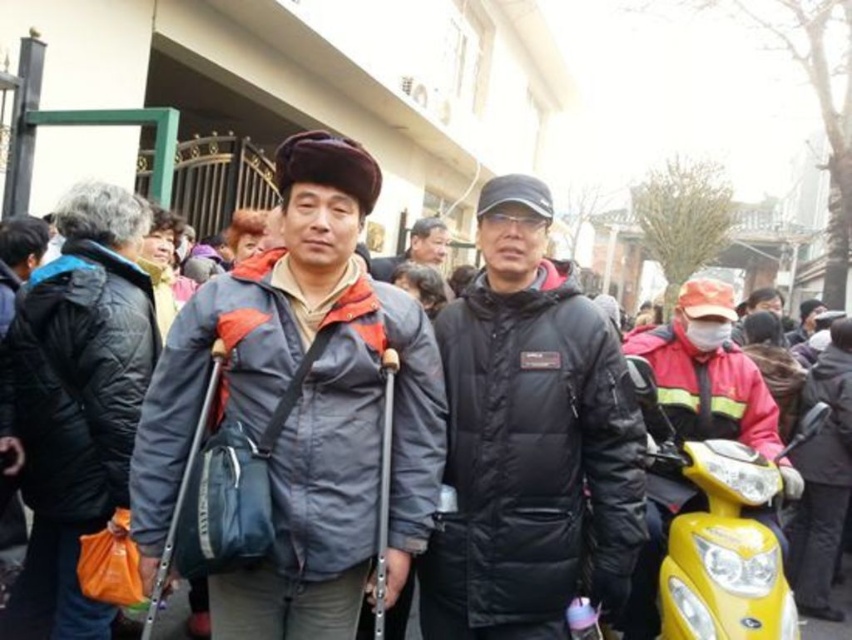
Question: Which is farther from the matte gray jacket at center?

Choices:
 (A) yellow matte motorcycle at lower right
 (B) dark gray puffer jacket at center
 (C) black matte jacket at center

Answer: (B)

Question: Does matte gray jacket at center appear on the left side of yellow matte motorcycle at lower right?

Choices:
 (A) yes
 (B) no

Answer: (A)

Question: Where is matte gray jacket at center located in relation to black matte jacket at center in the image?

Choices:
 (A) right
 (B) left

Answer: (B)

Question: Which is nearer to the matte gray jacket at center?

Choices:
 (A) dark gray puffer jacket at center
 (B) black matte jacket at center
 (C) yellow matte motorcycle at lower right

Answer: (B)

Question: Is black matte jacket at center bigger than yellow matte motorcycle at lower right?

Choices:
 (A) yes
 (B) no

Answer: (B)

Question: Which object is positioned closest to the yellow matte motorcycle at lower right?

Choices:
 (A) black matte jacket at center
 (B) matte gray jacket at center

Answer: (A)